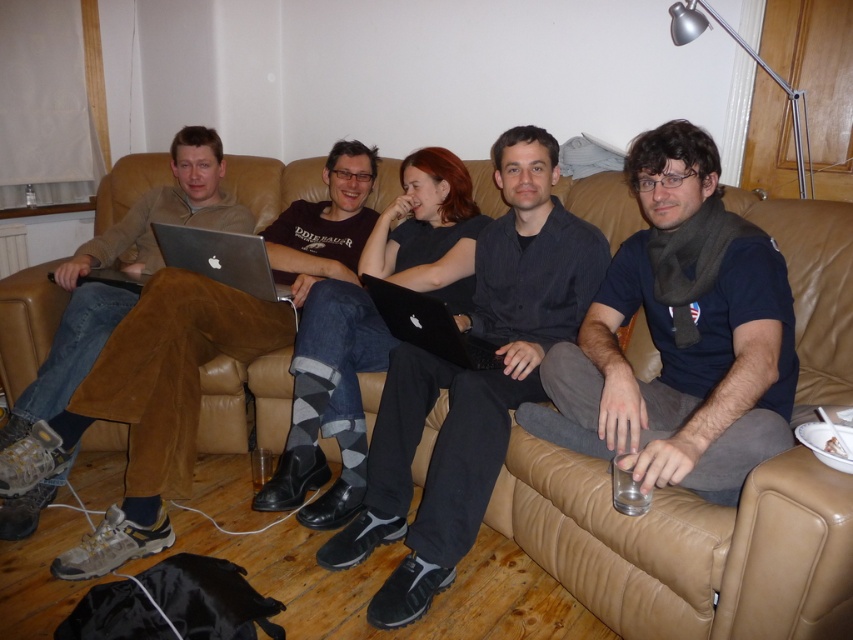
Question: Which object appears closest to the camera in this image?

Choices:
 (A) black matte laptop at center
 (B) dark gray argyle socks at center

Answer: (A)

Question: Which point is farther to the camera?

Choices:
 (A) (151, 266)
 (B) (428, 317)

Answer: (A)

Question: Which point is farther to the camera?

Choices:
 (A) (142, 282)
 (B) (172, 262)
 (C) (115, 321)
 (D) (368, 291)

Answer: (A)

Question: Does matte brown pants at left come in front of matte silver laptop at center?

Choices:
 (A) no
 (B) yes

Answer: (B)

Question: Can you confirm if dark gray shirt at center is positioned to the right of matte silver laptop at center?

Choices:
 (A) yes
 (B) no

Answer: (A)

Question: Is matte silver laptop at center positioned behind black matte laptop at center?

Choices:
 (A) yes
 (B) no

Answer: (A)